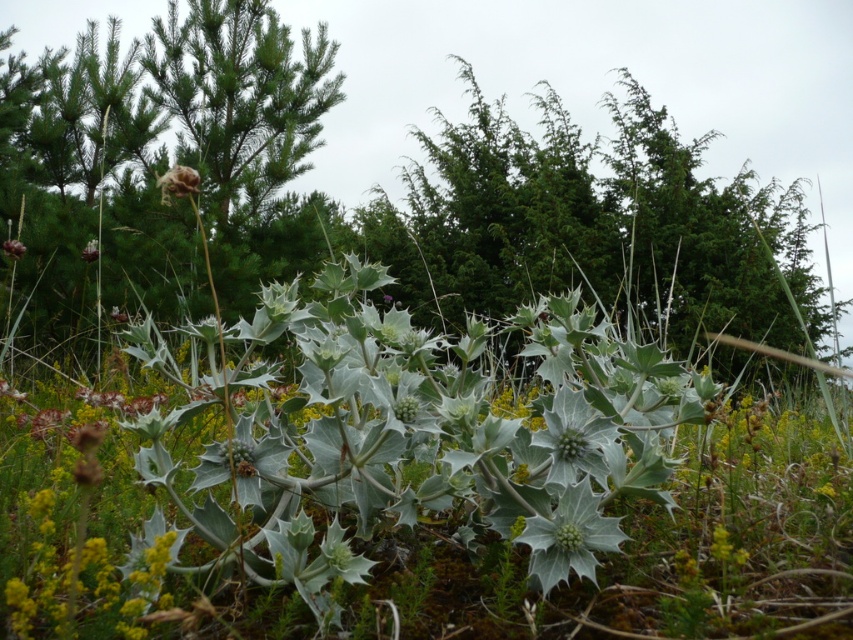
You are a botanist examining the plants in the scene. You need to determine the relative positions of the green spiky plant at center and the brown textured flower at upper left. Which plant is positioned higher in the image?

The green spiky plant at center is located above the brown textured flower at upper left, so it is positioned higher in the image.

You are a botanist examining the plants in the scene. You need to determine which object is bigger between the green spiky plant at center and the brown textured flower at upper left. Based on the scene, can you identify which one is larger?

The green spiky plant at center has a larger size compared to the brown textured flower at upper left, so the green spiky plant at center is bigger.

You are an entomologist observing the plants in this outdoor scene. You notice the fuzzy brown flower at upper center and the brown textured flower at upper left. Which flower is positioned to the east of the other?

The fuzzy brown flower at upper center is positioned to the east of the brown textured flower at upper left because it is located to the right of it in the image, which typically corresponds to east in such scenes.